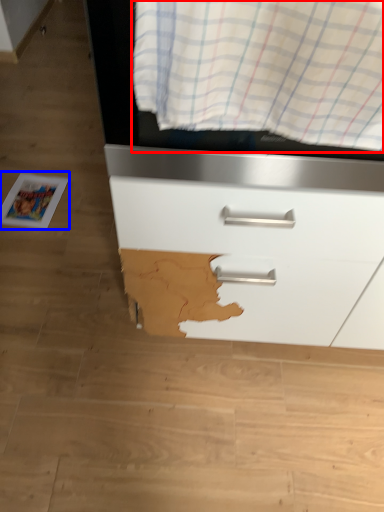
Question: Which of the following is the closest to the observer, curtain (highlighted by a red box) or magazine (highlighted by a blue box)?

Choices:
 (A) curtain
 (B) magazine

Answer: (A)